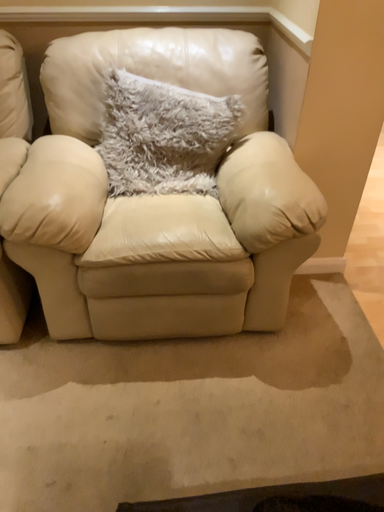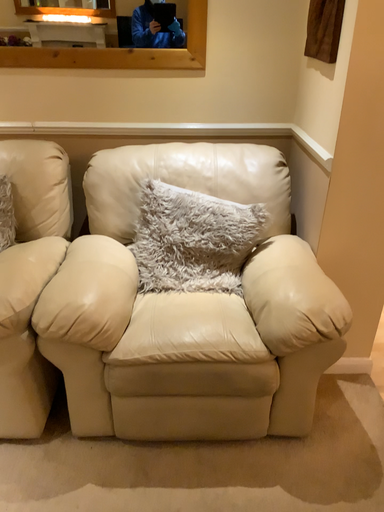
Question: How did the camera likely rotate when shooting the video?

Choices:
 (A) rotated upward
 (B) rotated downward

Answer: (A)